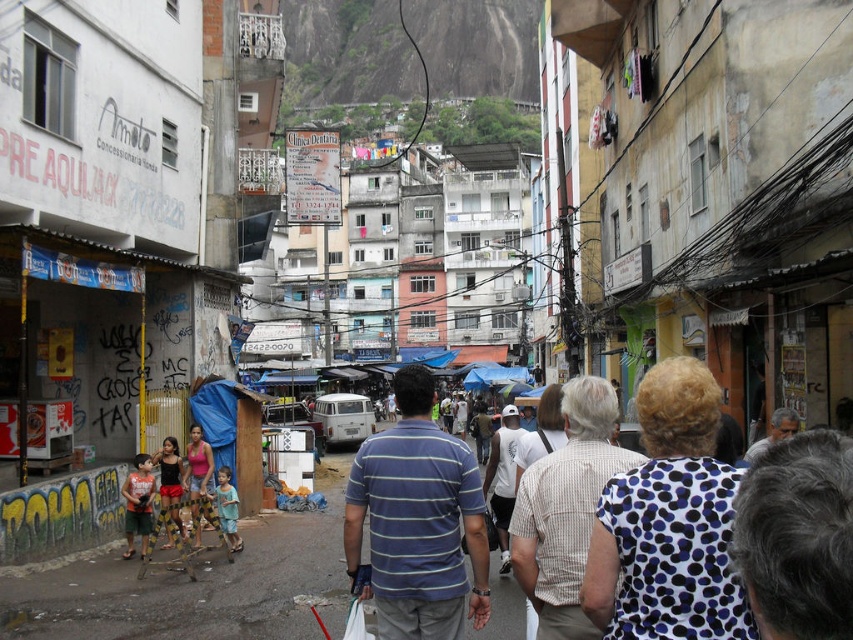
You are standing at the point with coordinates point (x=171, y=499) and want to walk to the point with coordinates point (x=459, y=545). Which direction should you move to reach your destination?

You should move forward because point (x=459, y=545) is in front of point (x=171, y=499).

You are a delivery person trying to navigate through the crowded street. You see an orange striped shirt at center and a matte black shorts at lower left. Which clothing item is bigger in size?

The orange striped shirt at center is larger in size compared to the matte black shorts at lower left.